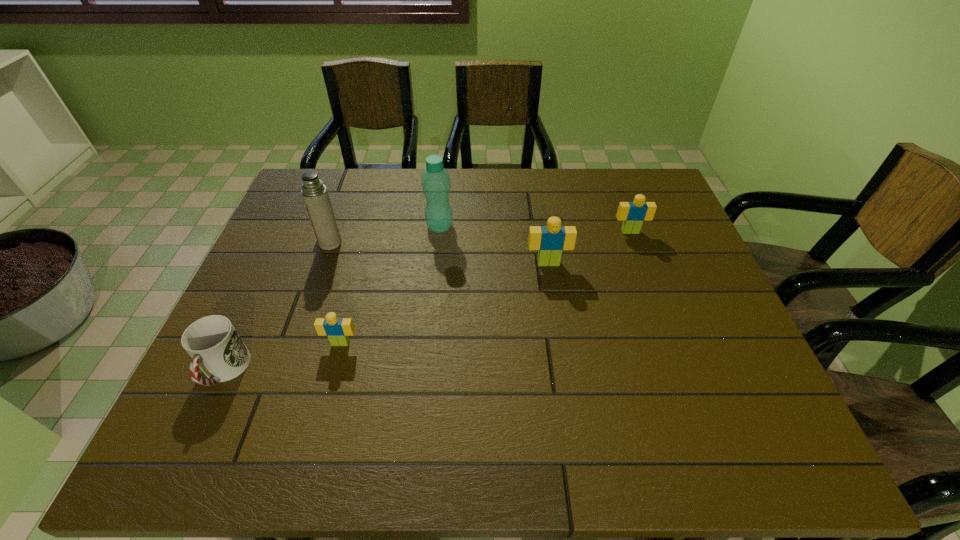
In order to click on the shortest Lego in this screenshot , I will do `click(338, 330)`.

I want to click on the third object from left to right, so click(x=338, y=330).

Locate an element on the screen. The height and width of the screenshot is (540, 960). the third nearest object is located at coordinates (550, 240).

The height and width of the screenshot is (540, 960). In order to click on the tallest Lego in this screenshot , I will do `click(550, 240)`.

Where is `the rightmost Lego`? The width and height of the screenshot is (960, 540). the rightmost Lego is located at coordinates (632, 214).

You are a GUI agent. You are given a task and a screenshot of the screen. Output one action in this format:
    pyautogui.click(x=<x>, y=<y>)
    Task: Click on the farthest Lego
    Image resolution: width=960 pixels, height=540 pixels.
    Given the screenshot: What is the action you would take?
    pyautogui.click(x=632, y=214)

Where is `bottle`? The height and width of the screenshot is (540, 960). bottle is located at coordinates (436, 184).

You are a GUI agent. You are given a task and a screenshot of the screen. Output one action in this format:
    pyautogui.click(x=<x>, y=<y>)
    Task: Click on the fifth object from right to left
    
    Given the screenshot: What is the action you would take?
    pyautogui.click(x=314, y=193)

Locate an element on the screen. The width and height of the screenshot is (960, 540). the leftmost object is located at coordinates (x=214, y=345).

You are a GUI agent. You are given a task and a screenshot of the screen. Output one action in this format:
    pyautogui.click(x=<x>, y=<y>)
    Task: Click on the free space located 0.110m on the face of the leftmost Lego
    The width and height of the screenshot is (960, 540).
    Given the screenshot: What is the action you would take?
    pyautogui.click(x=328, y=390)